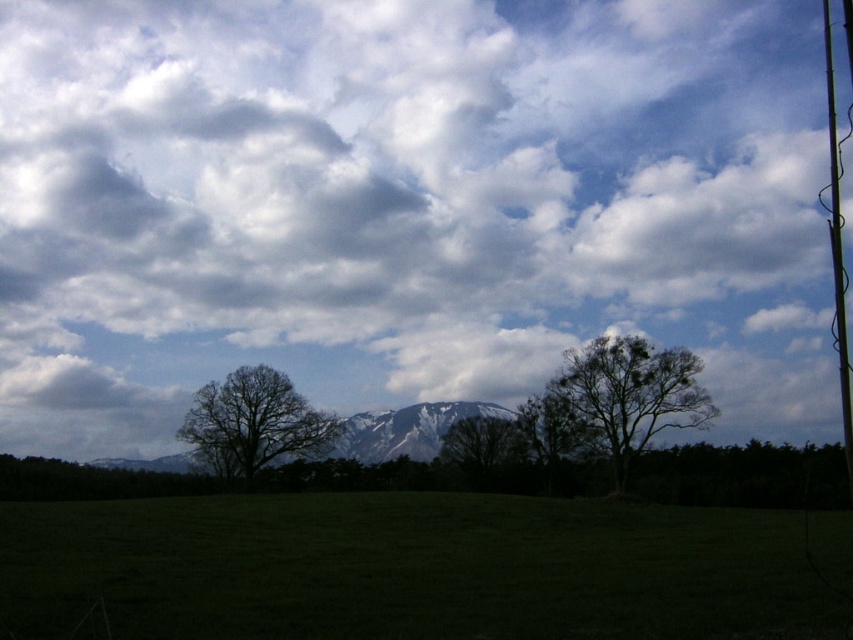
Question: Which of the following is the farthest from the observer?

Choices:
 (A) (161, 461)
 (B) (194, 612)
 (C) (515, 426)

Answer: (A)

Question: Is the position of snowy rock mountain at center less distant than that of dark brown leafless tree at center?

Choices:
 (A) no
 (B) yes

Answer: (A)

Question: Observing the image, what is the correct spatial positioning of cloudy sky at upper center in reference to bare branches tree at center?

Choices:
 (A) right
 (B) left

Answer: (B)

Question: Which of the following is the farthest from the observer?

Choices:
 (A) green grassy field at lower center
 (B) bare branches tree at center
 (C) snowy rock mountain at center

Answer: (C)

Question: Which object is closer to the camera taking this photo?

Choices:
 (A) snowy rock mountain at center
 (B) bare branches tree at center

Answer: (B)

Question: Is dark brown leafless tree at center wider than metallic wire at right?

Choices:
 (A) yes
 (B) no

Answer: (B)